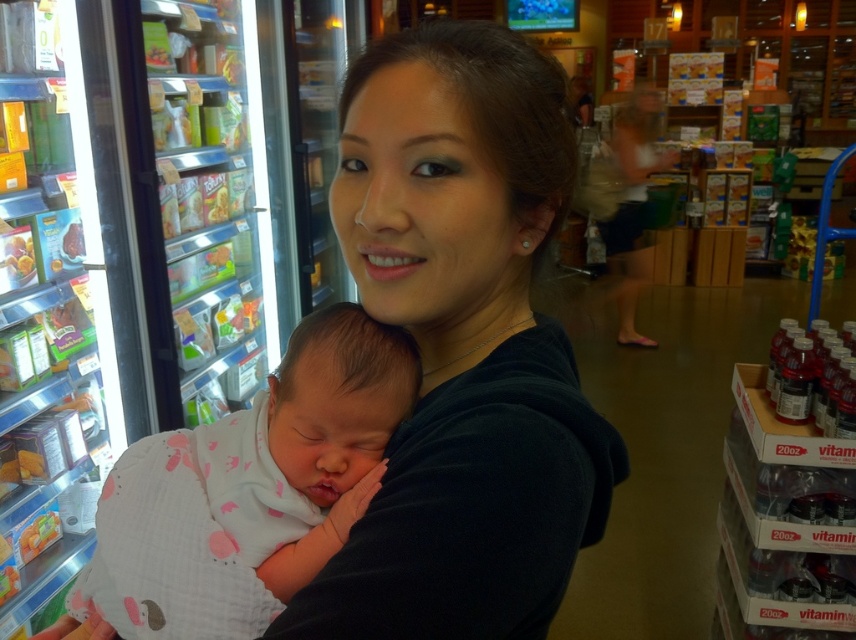
Can you confirm if black matte shirt at center is positioned to the right of white cotton swaddle at center?

Correct, you'll find black matte shirt at center to the right of white cotton swaddle at center.

Can you confirm if black matte shirt at center is shorter than white cotton swaddle at center?

In fact, black matte shirt at center may be taller than white cotton swaddle at center.

Locate an element on the screen. black matte shirt at center is located at coordinates (462, 346).